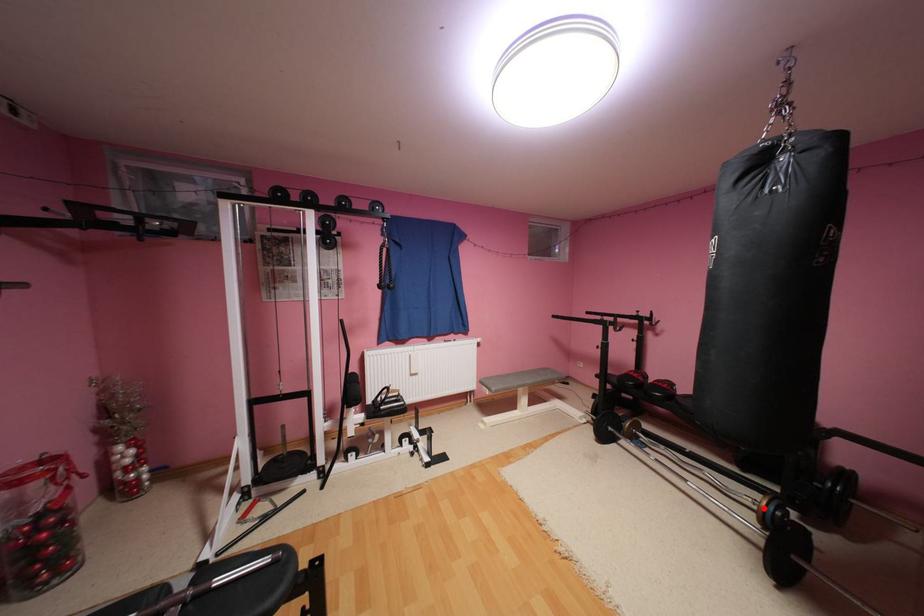
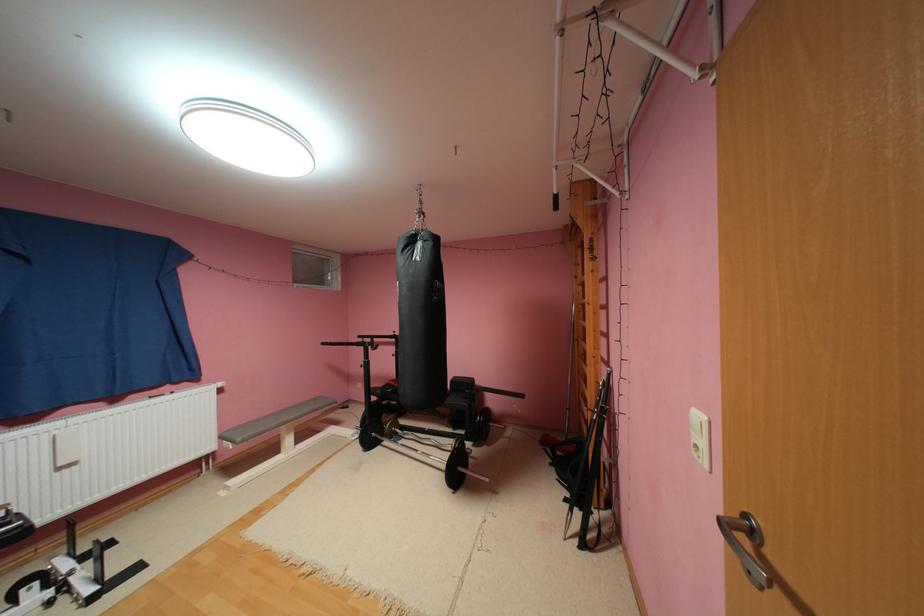
The point at the highlighted location is marked in the first image. Where is the corresponding point in the second image?

(458, 450)